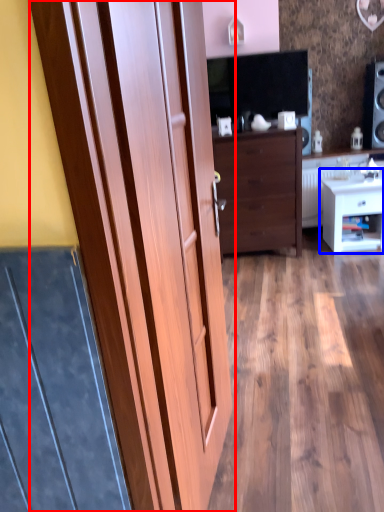
Question: Which object is closer to the camera taking this photo, door (highlighted by a red box) or nightstand (highlighted by a blue box)?

Choices:
 (A) door
 (B) nightstand

Answer: (A)